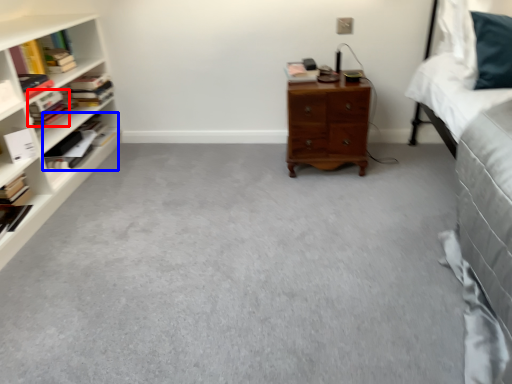
Question: Which object is further to the camera taking this photo, book (highlighted by a red box) or book (highlighted by a blue box)?

Choices:
 (A) book
 (B) book

Answer: (B)